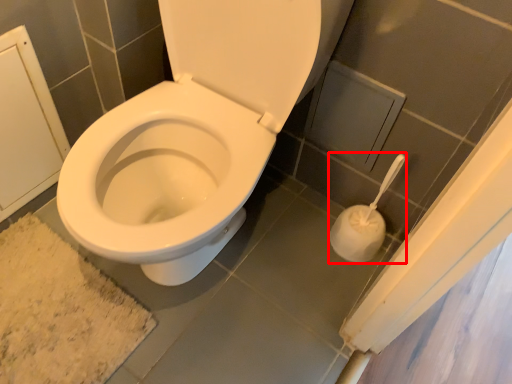
Question: Where is toilet paper (annotated by the red box) located in relation to bath mat in the image?

Choices:
 (A) right
 (B) left

Answer: (A)